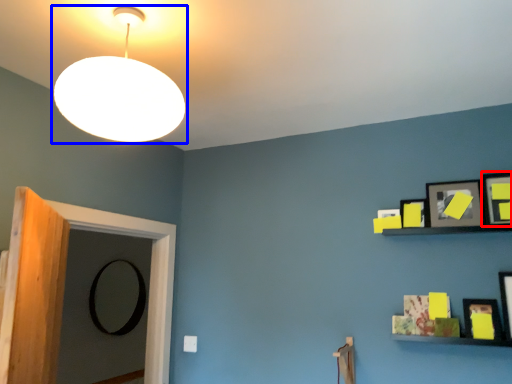
Question: Which of the following is the farthest to the observer, picture frame (highlighted by a red box) or lamp (highlighted by a blue box)?

Choices:
 (A) picture frame
 (B) lamp

Answer: (A)